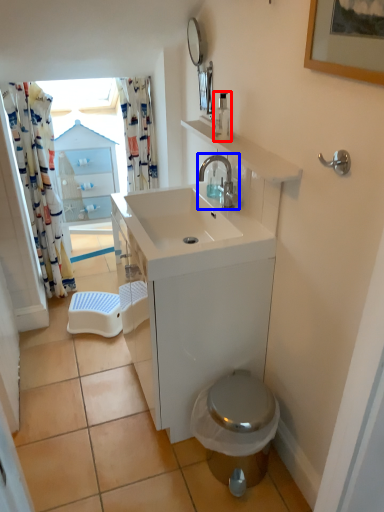
Question: Which object appears closest to the camera in this image, soap dispenser (highlighted by a red box) or tap (highlighted by a blue box)?

Choices:
 (A) soap dispenser
 (B) tap

Answer: (B)